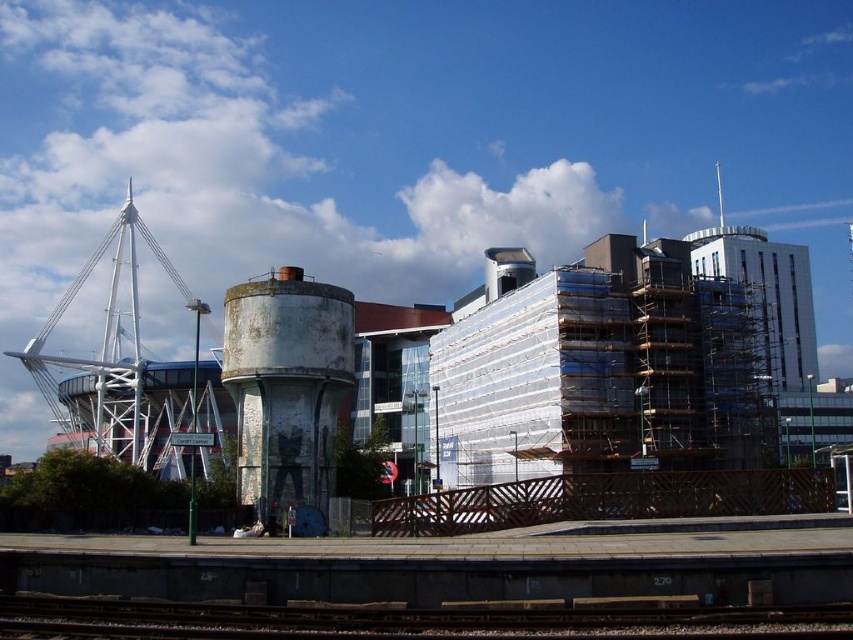
Question: Does metal at bottom have a larger size compared to white metallic structure at left?

Choices:
 (A) no
 (B) yes

Answer: (A)

Question: Which of the following is the closest to the observer?

Choices:
 (A) metal at bottom
 (B) white metallic structure at left
 (C) white concrete water tower at center-left

Answer: (A)

Question: Can you confirm if metal at bottom is positioned below white metallic structure at left?

Choices:
 (A) no
 (B) yes

Answer: (B)

Question: Which of the following is the closest to the observer?

Choices:
 (A) metal at bottom
 (B) white concrete water tower at center-left
 (C) white metallic structure at left

Answer: (A)

Question: Which object appears farthest from the camera in this image?

Choices:
 (A) metal at bottom
 (B) white metallic structure at left
 (C) white concrete water tower at center-left

Answer: (C)

Question: Observing the image, what is the correct spatial positioning of white concrete water tower at center-left in reference to white metallic structure at left?

Choices:
 (A) below
 (B) above

Answer: (A)